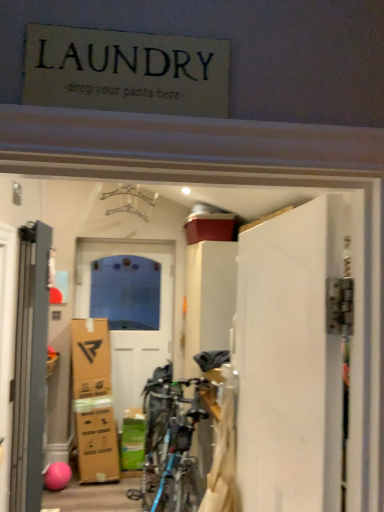
Question: Does white glossy door at center, acting as the 3th door starting from the front, have a larger size compared to gray matte door at left, which ranks as the second door in left-to-right order?

Choices:
 (A) yes
 (B) no

Answer: (A)

Question: Does white glossy door at center, acting as the 3th door starting from the front, have a greater width compared to gray matte door at left, which ranks as the 2th door in front-to-back order?

Choices:
 (A) no
 (B) yes

Answer: (A)

Question: Is white glossy door at center, acting as the 1th door starting from the back, further to the viewer compared to gray matte door at left, which is counted as the second door, starting from the right?

Choices:
 (A) yes
 (B) no

Answer: (A)

Question: From the image's perspective, is white glossy door at center, acting as the 1th door starting from the back, above gray matte door at left, which ranks as the 2th door in front-to-back order?

Choices:
 (A) no
 (B) yes

Answer: (A)

Question: Can you confirm if white glossy door at center, placed as the first door when sorted from left to right, is positioned to the right of gray matte door at left, which is counted as the second door, starting from the right?

Choices:
 (A) no
 (B) yes

Answer: (A)

Question: Can you confirm if white glossy door at center, placed as the first door when sorted from left to right, is thinner than gray matte door at left, which ranks as the second door in left-to-right order?

Choices:
 (A) no
 (B) yes

Answer: (B)

Question: Is gray matte door at left, which is counted as the second door, starting from the right, surrounding white glossy door at center, marked as the 3th door in a right-to-left arrangement?

Choices:
 (A) yes
 (B) no

Answer: (B)

Question: Does gray matte door at left, arranged as the second door when viewed from the back, come in front of white glossy door at center, marked as the 3th door in a right-to-left arrangement?

Choices:
 (A) yes
 (B) no

Answer: (A)

Question: Is gray matte door at left, which ranks as the second door in left-to-right order, shorter than white glossy door at center, marked as the 3th door in a right-to-left arrangement?

Choices:
 (A) no
 (B) yes

Answer: (B)

Question: Considering the relative positions of gray matte door at left, arranged as the second door when viewed from the back, and white glossy door at center, placed as the first door when sorted from left to right, in the image provided, is gray matte door at left, arranged as the second door when viewed from the back, to the right of white glossy door at center, placed as the first door when sorted from left to right, from the viewer's perspective?

Choices:
 (A) no
 (B) yes

Answer: (B)

Question: Is gray matte door at left, which ranks as the 2th door in front-to-back order, thinner than white glossy door at center, placed as the first door when sorted from left to right?

Choices:
 (A) no
 (B) yes

Answer: (A)

Question: Is gray matte door at left, which ranks as the second door in left-to-right order, taller than white glossy door at center, marked as the 3th door in a right-to-left arrangement?

Choices:
 (A) yes
 (B) no

Answer: (B)

Question: Is gray matte door at left, which ranks as the second door in left-to-right order, shorter than white matte door at right, arranged as the 1th door when viewed from the front?

Choices:
 (A) no
 (B) yes

Answer: (A)